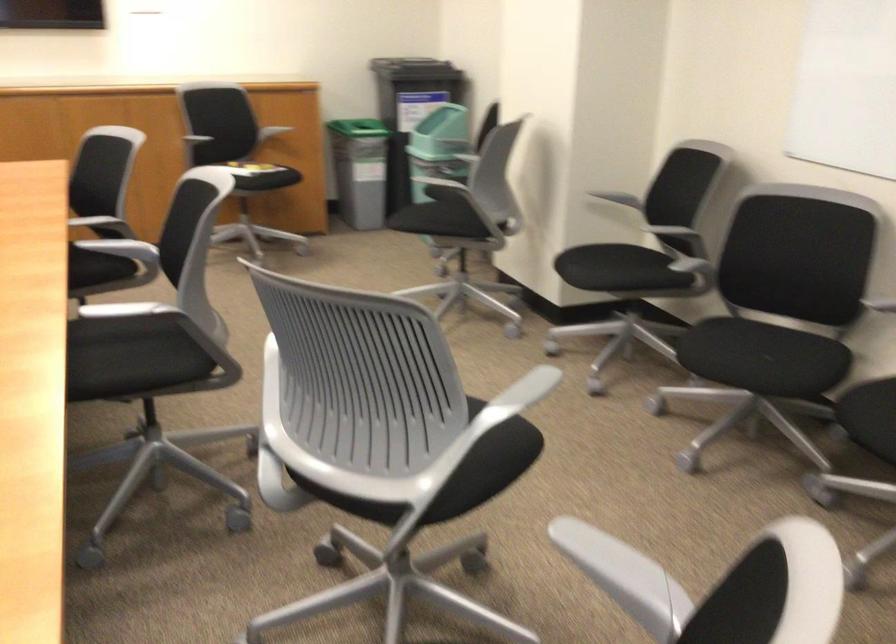
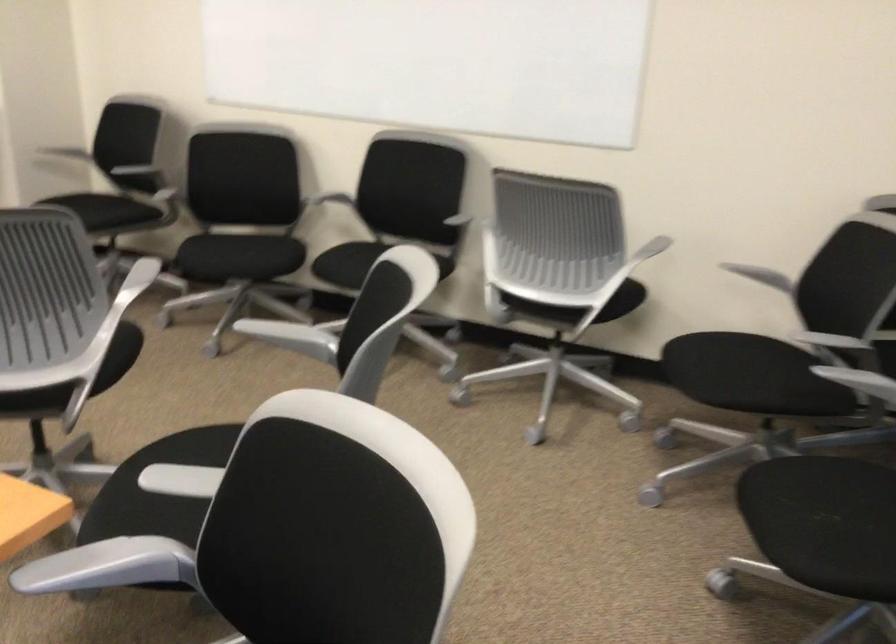
In the second image, find the point that corresponds to (597,268) in the first image.

(97, 213)